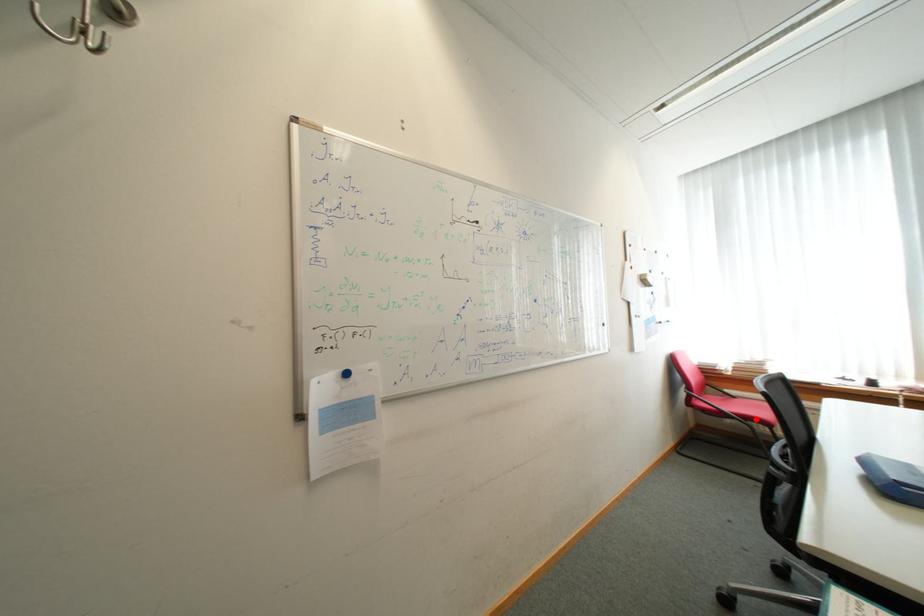
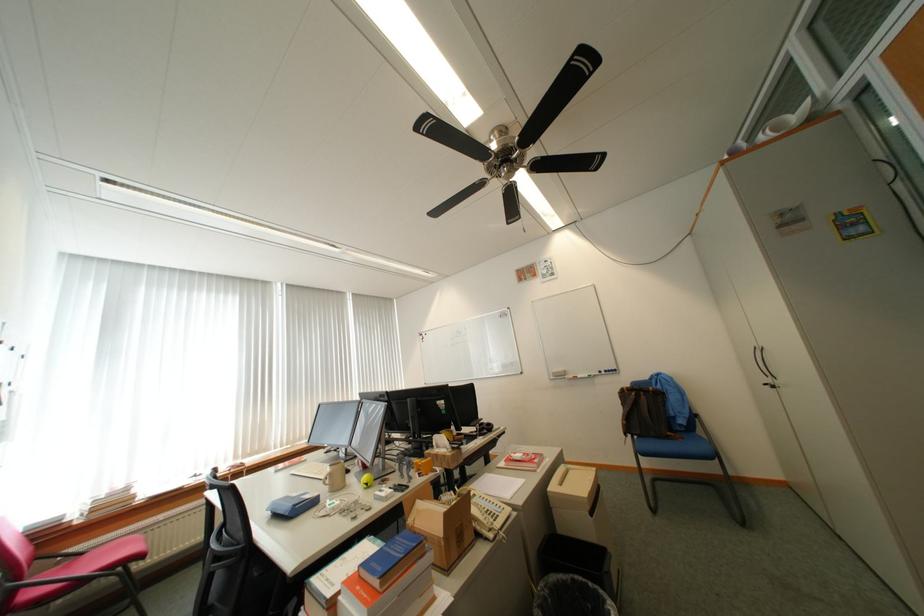
Question: I am providing you with two images of the same scene from different viewpoints. Image1 has a red point marked. In image2, the corresponding 3D location appears at what relative position? Reply with the corresponding letter.

Choices:
 (A) Closer
 (B) Farther

Answer: (A)